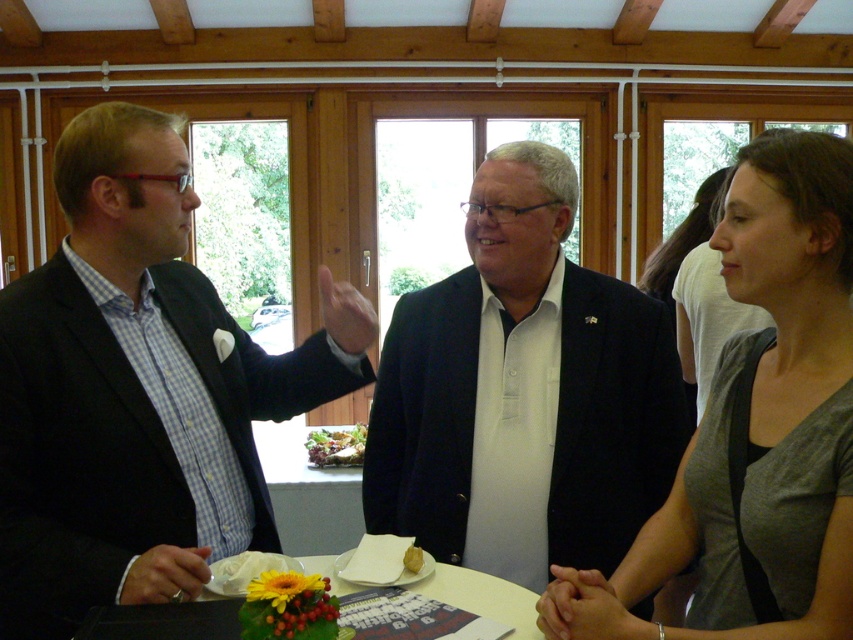
Is point (323, 464) closer to camera compared to point (410, 572)?

No, it is not.

How far apart are green leafy salad at center and yellow matte bread at center?

green leafy salad at center and yellow matte bread at center are 5.48 feet apart from each other.

This screenshot has width=853, height=640. I want to click on green leafy salad at center, so click(335, 445).

Who is shorter, matte black suit at left or dark blue suit at center?

matte black suit at left

Can you confirm if matte black suit at left is positioned below dark blue suit at center?

Incorrect, matte black suit at left is not positioned below dark blue suit at center.

Is point (99, 125) behind point (445, 384)?

No, it is not.

Image resolution: width=853 pixels, height=640 pixels. Find the location of `matte black suit at left`. matte black suit at left is located at coordinates (138, 388).

Which is below, white glossy table at lower center or yellow flower at center?

white glossy table at lower center is lower down.

Is white glossy table at lower center to the right of yellow flower at center from the viewer's perspective?

Yes, white glossy table at lower center is to the right of yellow flower at center.

The image size is (853, 640). I want to click on white glossy table at lower center, so click(483, 596).